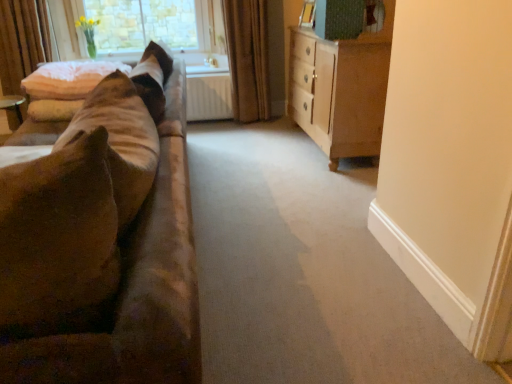
Describe the element at coordinates (98, 252) in the screenshot. I see `suede-like brown couch at left` at that location.

This screenshot has height=384, width=512. What do you see at coordinates (247, 58) in the screenshot?
I see `brown textured curtain at center` at bounding box center [247, 58].

In the scene shown: What is the approximate height of white fluffy pillow at upper left?

The height of white fluffy pillow at upper left is 24.65 centimeters.

At what (x,y) coordinates should I click in order to perform the action: click on light brown wood dresser at right. Please return your answer as a coordinate pair (x, y). The height and width of the screenshot is (384, 512). Looking at the image, I should click on (341, 89).

In the scene shown: Which object is further away from the camera taking this photo, clear glass window at upper left or brown textured curtain at center?

clear glass window at upper left is more distant.

Who is bigger, clear glass window at upper left or brown textured curtain at center?

Bigger between the two is brown textured curtain at center.

Does point (203, 49) lie in front of point (247, 36)?

No, it is not.

Which is more to the left, clear glass window at upper left or brown textured curtain at center?

clear glass window at upper left is more to the left.

Is the surface of brown textured curtain at center in direct contact with light brown wood dresser at right?

There is a gap between brown textured curtain at center and light brown wood dresser at right.

What's the angular difference between brown textured curtain at center and light brown wood dresser at right's facing directions?

They differ by 85.9 degrees in their facing directions.

Between brown textured curtain at center and light brown wood dresser at right, which one has less height?

With less height is light brown wood dresser at right.

Is brown textured curtain at center positioned with its back to light brown wood dresser at right?

No, light brown wood dresser at right is not at the back of brown textured curtain at center.

Is light brown wood dresser at right outside of clear glass window at upper left?

Yes, light brown wood dresser at right is located beyond the bounds of clear glass window at upper left.

Are light brown wood dresser at right and clear glass window at upper left beside each other?

light brown wood dresser at right and clear glass window at upper left are clearly separated.

Does point (319, 84) come farther from viewer compared to point (111, 20)?

No.

Is clear glass window at upper left facing away from light brown wood dresser at right?

No, light brown wood dresser at right is not at the back of clear glass window at upper left.

Is clear glass window at upper left spatially inside light brown wood dresser at right, or outside of it?

clear glass window at upper left is outside light brown wood dresser at right.

Is suede-like brown couch at left smaller than light brown wood dresser at right?

No.

Is suede-like brown couch at left aimed at light brown wood dresser at right?

No, suede-like brown couch at left is not oriented towards light brown wood dresser at right.

From a real-world perspective, is suede-like brown couch at left below light brown wood dresser at right?

Yes, from a real-world perspective, suede-like brown couch at left is below light brown wood dresser at right.

Between point (111, 45) and point (25, 298), which one is positioned behind?

The point (111, 45) is farther.

Image resolution: width=512 pixels, height=384 pixels. I want to click on studio couch lying below the clear glass window at upper left (from the image's perspective), so click(x=98, y=252).

Considering the relative sizes of clear glass window at upper left and suede-like brown couch at left in the image provided, is clear glass window at upper left smaller than suede-like brown couch at left?

Indeed, clear glass window at upper left has a smaller size compared to suede-like brown couch at left.

From the image's perspective, who appears lower, clear glass window at upper left or suede-like brown couch at left?

suede-like brown couch at left is shown below in the image.

Considering the positions of point (44, 84) and point (253, 20), is point (44, 84) closer or farther from the camera than point (253, 20)?

Point (44, 84) appears to be closer to the viewer than point (253, 20).

From the image's perspective, is white fluffy pillow at upper left located beneath brown textured curtain at center?

Indeed, from the image's perspective, white fluffy pillow at upper left is shown beneath brown textured curtain at center.

Image resolution: width=512 pixels, height=384 pixels. I want to click on curtain below the white fluffy pillow at upper left (from a real-world perspective), so click(x=247, y=58).

Is white fluffy pillow at upper left closer to camera compared to brown textured curtain at center?

Yes, white fluffy pillow at upper left is in front of brown textured curtain at center.

Identify the location of window to the left of brown textured curtain at center. This screenshot has height=384, width=512. (144, 24).

I want to click on curtain above the light brown wood dresser at right (from a real-world perspective), so click(247, 58).

When comparing their distances from suede-like brown couch at left, does white fluffy pillow at upper left or light brown wood dresser at right seem further?

light brown wood dresser at right is further to suede-like brown couch at left.

Estimate the real-world distances between objects in this image. Which object is further from brown textured curtain at center, clear glass window at upper left or white fluffy pillow at upper left?

white fluffy pillow at upper left is positioned further to the anchor brown textured curtain at center.

Estimate the real-world distances between objects in this image. Which object is closer to light brown wood dresser at right, suede-like brown couch at left or white fluffy pillow at upper left?

white fluffy pillow at upper left lies closer to light brown wood dresser at right than the other object.

Based on their spatial positions, is clear glass window at upper left or suede-like brown couch at left further from light brown wood dresser at right?

Based on the image, suede-like brown couch at left appears to be further to light brown wood dresser at right.

Which object lies nearer to the anchor point light brown wood dresser at right, clear glass window at upper left or brown textured curtain at center?

Among the two, brown textured curtain at center is located nearer to light brown wood dresser at right.

Looking at the image, which one is located closer to white fluffy pillow at upper left, brown textured curtain at center or clear glass window at upper left?

Based on the image, clear glass window at upper left appears to be nearer to white fluffy pillow at upper left.

Looking at the image, which one is located closer to brown textured curtain at center, suede-like brown couch at left or light brown wood dresser at right?

light brown wood dresser at right is positioned closer to the anchor brown textured curtain at center.

Estimate the real-world distances between objects in this image. Which object is further from white fluffy pillow at upper left, suede-like brown couch at left or clear glass window at upper left?

suede-like brown couch at left.

Locate an element on the screen. The width and height of the screenshot is (512, 384). cabinetry between suede-like brown couch at left and clear glass window at upper left in the front-back direction is located at coordinates (341, 89).

Locate an element on the screen. The height and width of the screenshot is (384, 512). curtain between white fluffy pillow at upper left and clear glass window at upper left along the z-axis is located at coordinates (247, 58).

At what (x,y) coordinates should I click in order to perform the action: click on window between white fluffy pillow at upper left and light brown wood dresser at right from left to right. Please return your answer as a coordinate pair (x, y). This screenshot has width=512, height=384. Looking at the image, I should click on (144, 24).

This screenshot has width=512, height=384. Find the location of `curtain situated between clear glass window at upper left and light brown wood dresser at right from left to right`. curtain situated between clear glass window at upper left and light brown wood dresser at right from left to right is located at coordinates (247, 58).